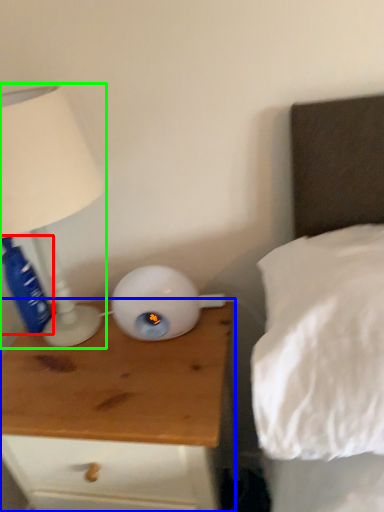
Question: Based on their relative distances, which object is nearer to bottle (highlighted by a red box)? Choose from nightstand (highlighted by a blue box) and lamp (highlighted by a green box).

Choices:
 (A) nightstand
 (B) lamp

Answer: (B)